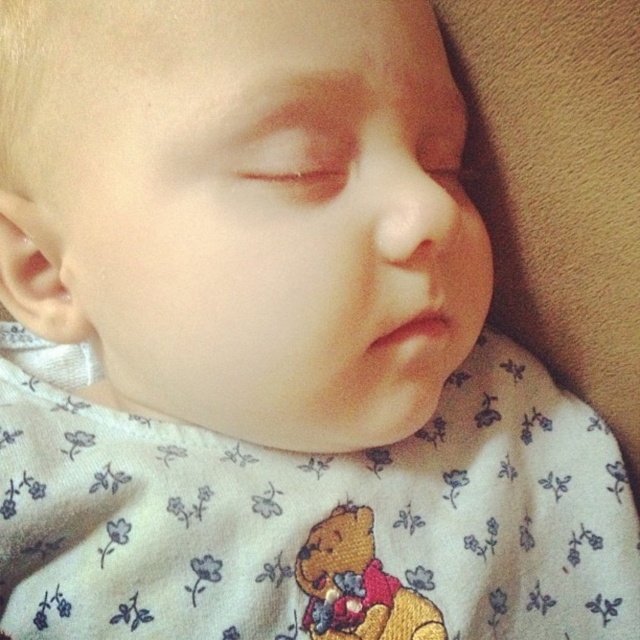
What are the coordinates of the smooth skin baby at center?

The smooth skin baby at center is located at point (243, 209).

Looking at the sleeping baby in the image, which object has a greater width between the smooth skin baby at center and the embroidered plush bear at center?

The smooth skin baby at center has a greater width than the embroidered plush bear at center.

You are a photographer taking a closeup of a baby. You notice the smooth skin baby at center and the embroidered plush bear at center. Which object is closer to your camera lens?

The smooth skin baby at center is closer to the viewer than the embroidered plush bear at center, so the smooth skin baby at center is closer to the camera lens.